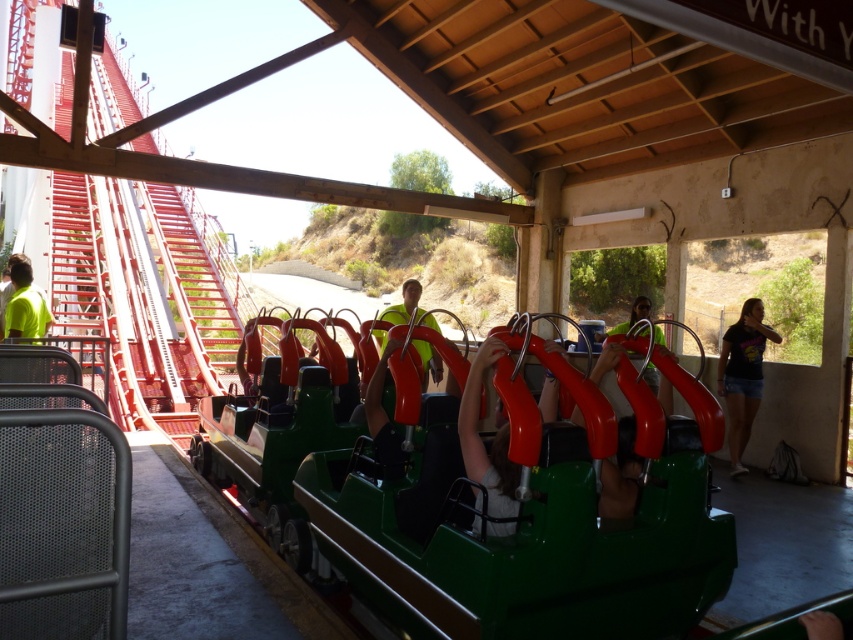
Does matte yellow safety vest at center lie behind matte red handlebar at center?

Yes, it is behind matte red handlebar at center.

Between point (408, 285) and point (662, 346), which one is positioned behind?

The point (408, 285) is more distant.

Locate an element on the screen. The width and height of the screenshot is (853, 640). matte yellow safety vest at center is located at coordinates (407, 307).

Is matte black t-shirt at right shorter than matte red handlebar at center?

No, matte black t-shirt at right is not shorter than matte red handlebar at center.

Looking at this image, is matte black t-shirt at right bigger than matte red handlebar at center?

No, matte black t-shirt at right is not bigger than matte red handlebar at center.

Which is behind, point (764, 333) or point (650, 369)?

Positioned behind is point (764, 333).

Locate an element on the screen. The width and height of the screenshot is (853, 640). matte black t-shirt at right is located at coordinates (741, 376).

In the scene shown: Is yellow high-visibility vest at left smaller than matte yellow safety vest at center?

Yes.

Which is below, yellow high-visibility vest at left or matte yellow safety vest at center?

matte yellow safety vest at center

This screenshot has height=640, width=853. Identify the location of yellow high-visibility vest at left. (25, 304).